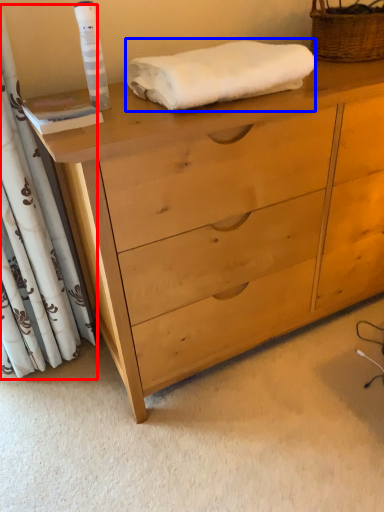
Question: Which object is further to the camera taking this photo, curtain (highlighted by a red box) or bath towel (highlighted by a blue box)?

Choices:
 (A) curtain
 (B) bath towel

Answer: (B)